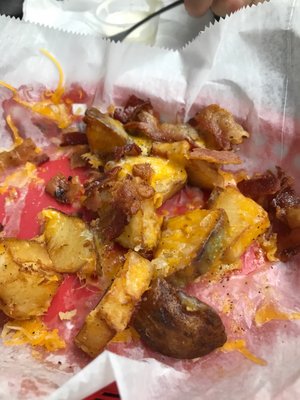
This screenshot has width=300, height=400. In order to click on sheet in this screenshot , I will do `click(251, 385)`.